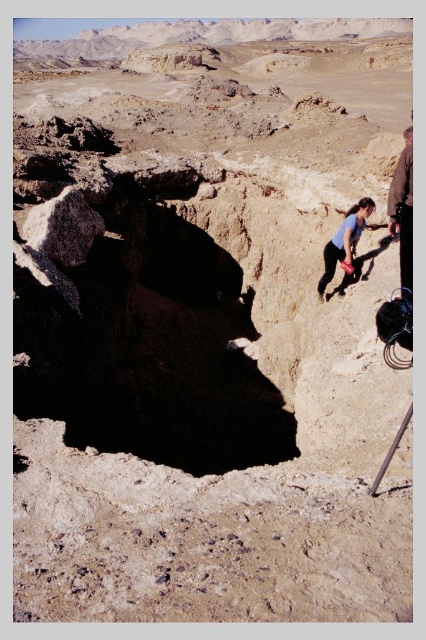
You are a hiker trying to locate your friend who is wearing a brown leather jacket at right. You are currently standing near the dark gray rough rock at left. According to the scene, can you see your friend through the rock?

The brown leather jacket at right is behind the dark gray rough rock at left, so you cannot see your friend through the rock.

You are standing in the desert scene and want to hand a water bottle to the person wearing the blue fabric shirt at center. Which direction should you move relative to the brown leather jacket at right?

The brown leather jacket at right is to the right of the blue fabric shirt at center. To reach the blue fabric shirt at center, you should move to the left from the brown leather jacket at right.

You are a hiker who wants to take a photo of the blue fabric shirt at center and the dark gray rough rock at left. Which object should you focus on first if you want to capture both in the same frame without moving the camera?

The dark gray rough rock at left is shorter than the blue fabric shirt at center, so you should focus on the blue fabric shirt at center first to ensure both are in focus.